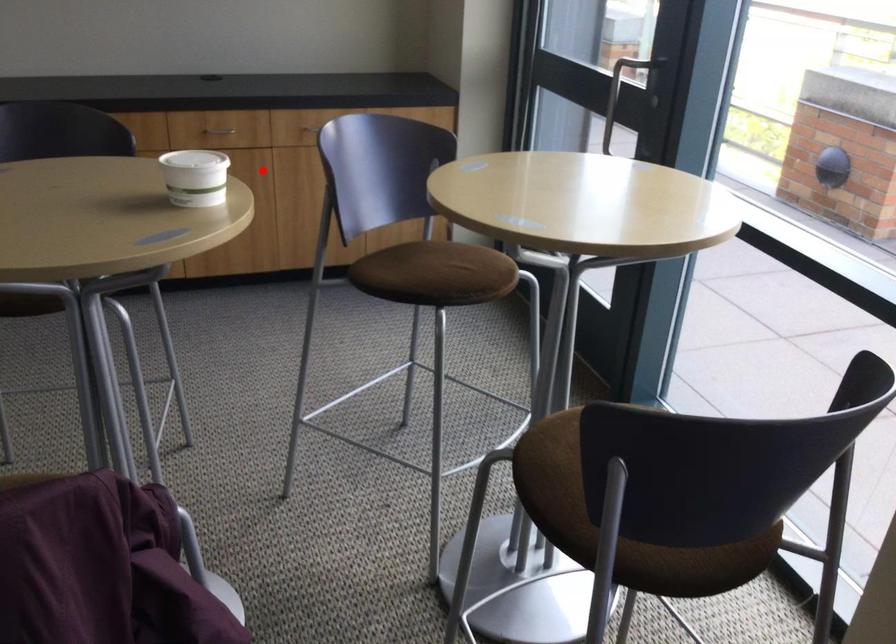
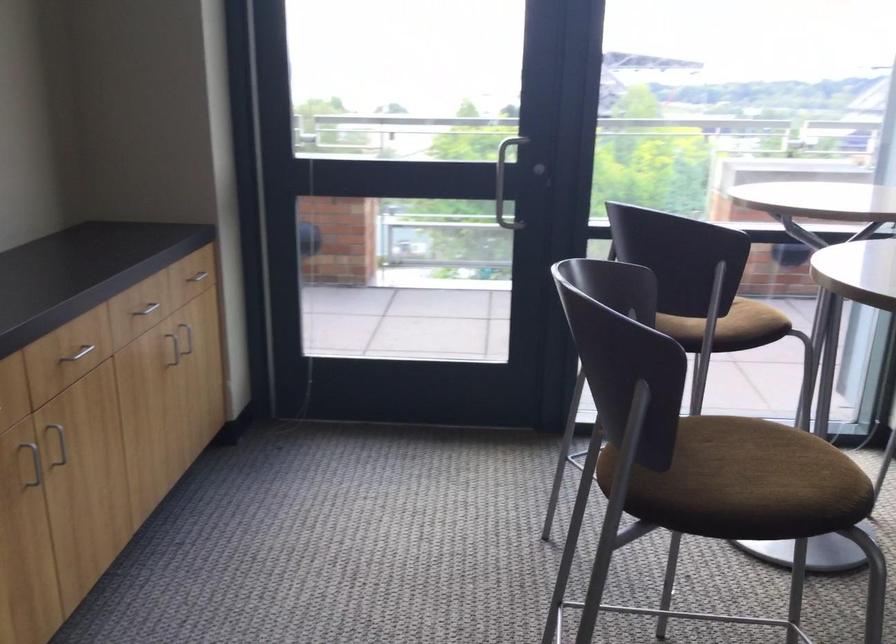
Question: I am providing you with two images of the same scene from different viewpoints. Image1 has a red point marked. In image2, the corresponding 3D location appears at what relative position? Reply with the corresponding letter.

Choices:
 (A) Closer
 (B) Farther

Answer: (A)